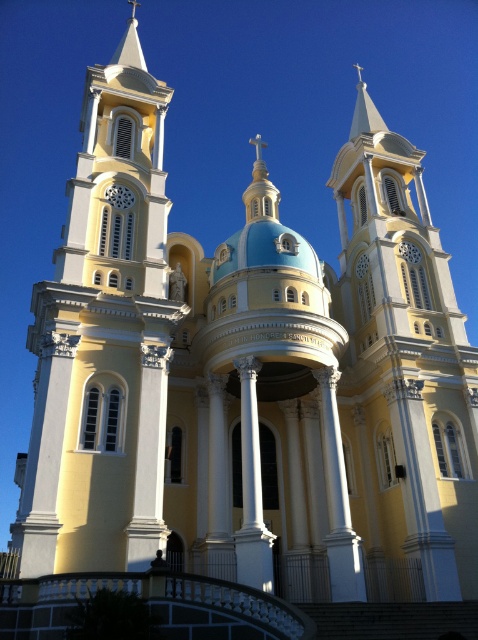
Is matte yellow tower at center further to the viewer compared to white marble column at center?

No, matte yellow tower at center is closer to the viewer.

Which is in front, point (78, 513) or point (242, 513)?

Point (78, 513) is more forward.

You are a GUI agent. You are given a task and a screenshot of the screen. Output one action in this format:
    pyautogui.click(x=<x>, y=<y>)
    Task: Click on the matte yellow tower at center
    The image size is (478, 640).
    Given the screenshot: What is the action you would take?
    coord(104,340)

Who is positioned more to the right, matte yellow tower at center or white glossy column at center?

white glossy column at center

Can you confirm if matte yellow tower at center is positioned below white glossy column at center?

Incorrect, matte yellow tower at center is not positioned below white glossy column at center.

Which is in front, point (110, 392) or point (336, 369)?

Point (110, 392) is more forward.

This screenshot has height=640, width=478. In order to click on matte yellow tower at center in this screenshot , I will do `click(104, 340)`.

Does white glossy column at center have a greater width compared to white marble column at center?

No.

Who is higher up, white glossy column at center or white marble column at center?

Positioned higher is white marble column at center.

Is point (314, 371) less distant than point (256, 464)?

No.

At what (x,y) coordinates should I click in order to perform the action: click on white glossy column at center. Please return your answer as a coordinate pair (x, y). The image size is (478, 640). Looking at the image, I should click on (337, 499).